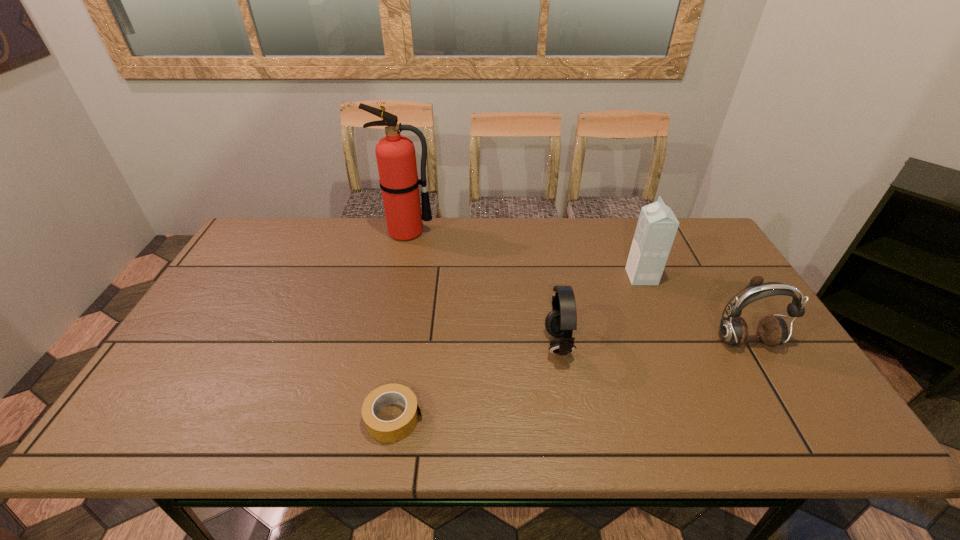
You are a GUI agent. You are given a task and a screenshot of the screen. Output one action in this format:
    pyautogui.click(x=<x>, y=<y>)
    Task: Click on the free spot located at the nozzle of the farthest object
    This screenshot has height=540, width=960.
    Given the screenshot: What is the action you would take?
    pyautogui.click(x=397, y=276)

Where is `vacant space located 0.140m on the front label of the carton`? vacant space located 0.140m on the front label of the carton is located at coordinates (582, 277).

Image resolution: width=960 pixels, height=540 pixels. What are the coordinates of `free location located on the front label of the carton` in the screenshot? It's located at 503,277.

The height and width of the screenshot is (540, 960). I want to click on vacant region located on the front label of the carton, so click(572, 277).

Locate an element on the screen. The width and height of the screenshot is (960, 540). free spot located on the ear pads of the taller earphone is located at coordinates (798, 430).

Identify the location of vacant point located on the ear cups of the shorter earphone. (401, 344).

The width and height of the screenshot is (960, 540). I want to click on free space located on the ear cups of the shorter earphone, so click(x=487, y=344).

This screenshot has height=540, width=960. Identify the location of free region located 0.100m on the ear cups of the shorter earphone. (506, 344).

In order to click on free space located 0.400m at the edge of the duct tape in this screenshot , I will do `click(603, 418)`.

This screenshot has width=960, height=540. Find the location of `object that is at the far edge`. object that is at the far edge is located at coordinates (395, 154).